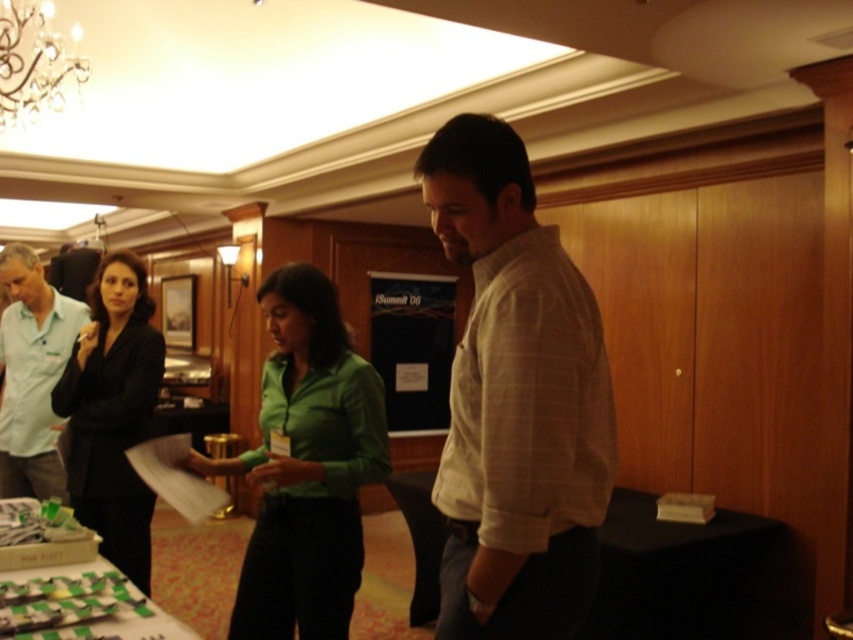
In the scene shown: You are a photographer setting up for an event. You notice the light brown plaid shirt at center and the crystal glass chandelier at upper left. Which object takes up more visual space in the image?

The crystal glass chandelier at upper left takes up more visual space in the image than the light brown plaid shirt at center.

You are a photographer at the iSummit event and need to capture a photo of both the light brown plaid shirt at center and the green matte shirt at center in the same frame. Based on their current positions, will you be able to fit both individuals into your camera frame if your camera has a maximum width capacity of 30 inches?

The light brown plaid shirt at center and green matte shirt at center are 30.45 inches apart from each other. Since the distance between them exceeds the camera frame width of 30 inches, you will not be able to fit both into the frame without moving closer or adjusting the camera angle.